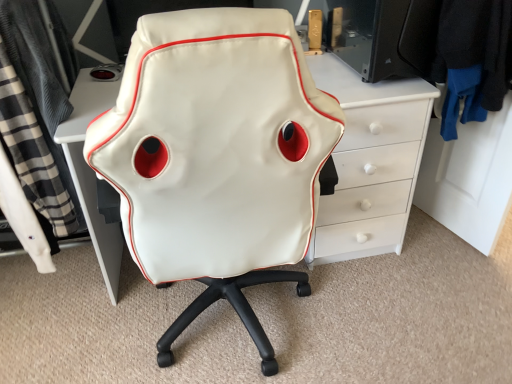
Question: Is point (2, 34) positioned closer to the camera than point (502, 64)?

Choices:
 (A) closer
 (B) farther

Answer: (A)

Question: Is black plaid fabric at left, the 2th clothing viewed from the right, situated inside black fabric jacket at upper right, the 2th clothing when ordered from left to right, or outside?

Choices:
 (A) outside
 (B) inside

Answer: (A)

Question: Which of these objects is positioned closest to the black fabric jacket at upper right, the 2th clothing when ordered from left to right?

Choices:
 (A) black plaid fabric at left, which appears as the 1th clothing when viewed from the left
 (B) white leather chair at center

Answer: (B)

Question: Which of these objects is positioned farthest from the white leather chair at center?

Choices:
 (A) black plaid fabric at left, which appears as the 1th clothing when viewed from the left
 (B) black fabric jacket at upper right, which is the 1th clothing from right to left

Answer: (B)